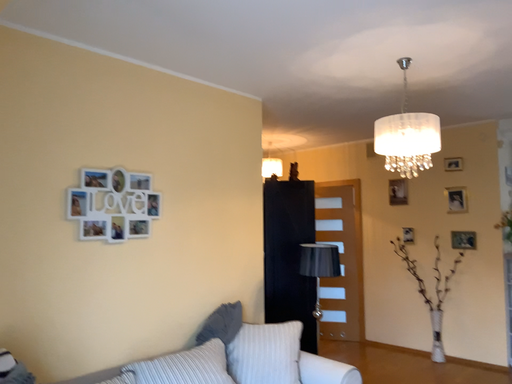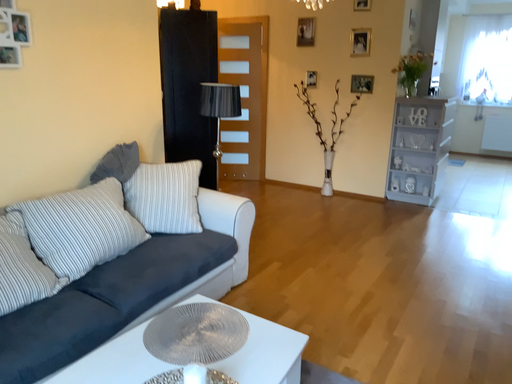
Question: How did the camera likely rotate when shooting the video?

Choices:
 (A) rotated left
 (B) rotated right

Answer: (B)